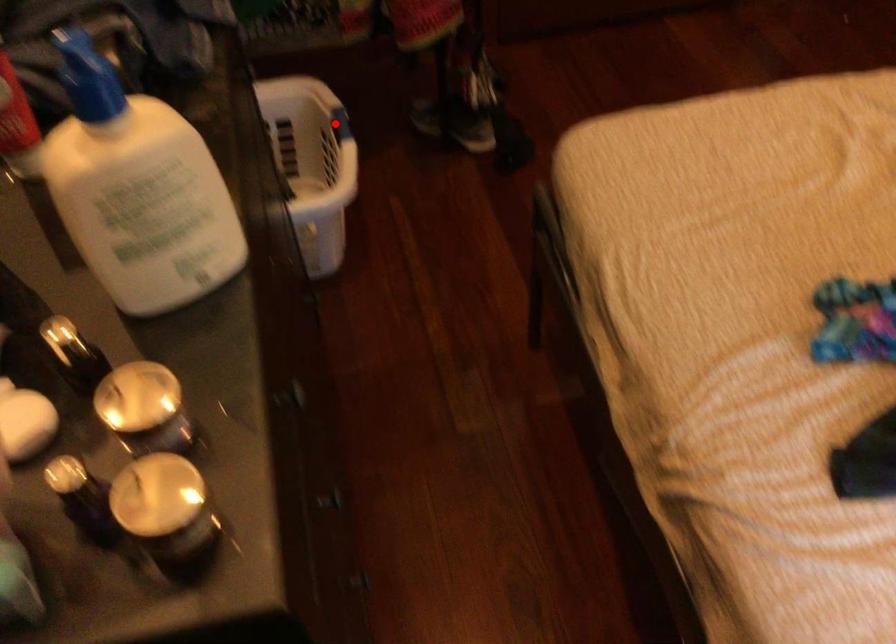
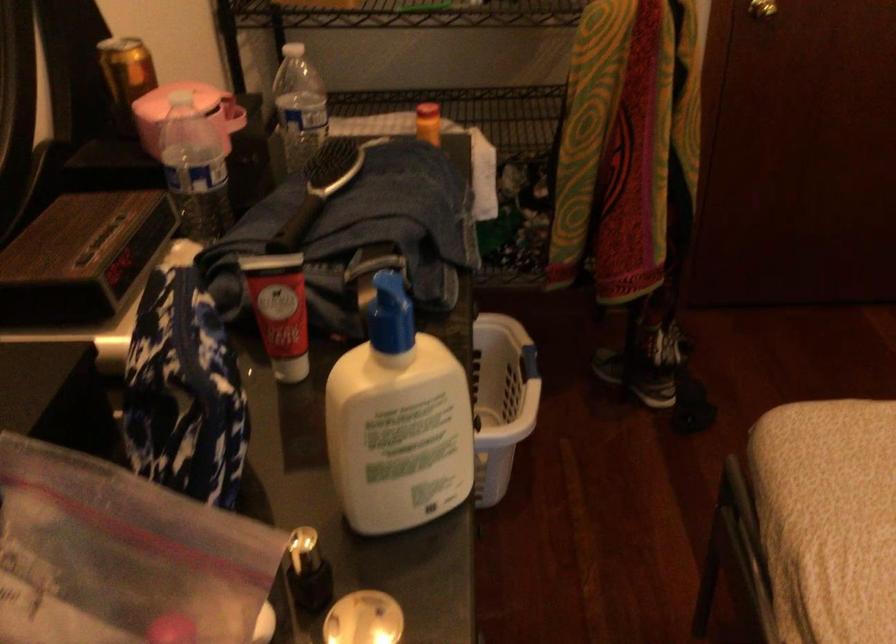
Where in the second image is the point corresponding to the highlighted location from the first image?

(529, 363)